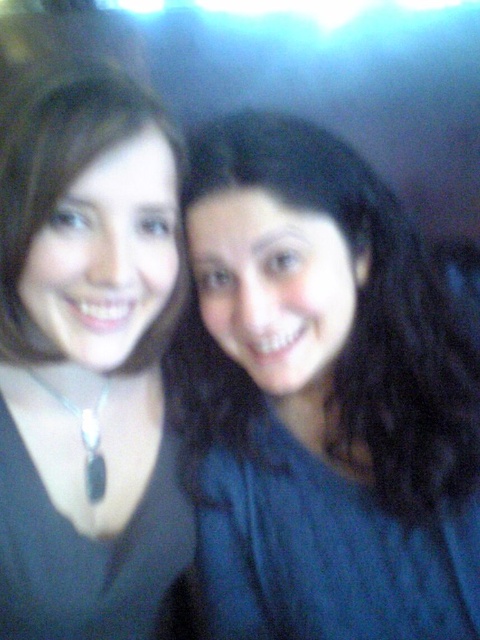
Question: Considering the relative positions of dark blue sweater at center and black matte necklace at left in the image provided, where is dark blue sweater at center located with respect to black matte necklace at left?

Choices:
 (A) above
 (B) below

Answer: (A)

Question: Estimate the real-world distances between objects in this image. Which object is farther from the black matte necklace at left?

Choices:
 (A) black matte necklace at center
 (B) dark blue knitted dress at center
 (C) dark blue sweater at center

Answer: (C)

Question: Does dark blue sweater at center have a larger size compared to black matte necklace at left?

Choices:
 (A) no
 (B) yes

Answer: (B)

Question: Which point appears farthest from the camera in this image?

Choices:
 (A) (16, 612)
 (B) (31, 115)
 (C) (330, 492)
 (D) (333, 202)

Answer: (C)

Question: Is black matte necklace at center wider than black matte necklace at left?

Choices:
 (A) no
 (B) yes

Answer: (B)

Question: Which point is closer to the camera?

Choices:
 (A) black matte necklace at left
 (B) dark blue knitted dress at center
 (C) black matte necklace at center
 (D) dark blue sweater at center

Answer: (C)